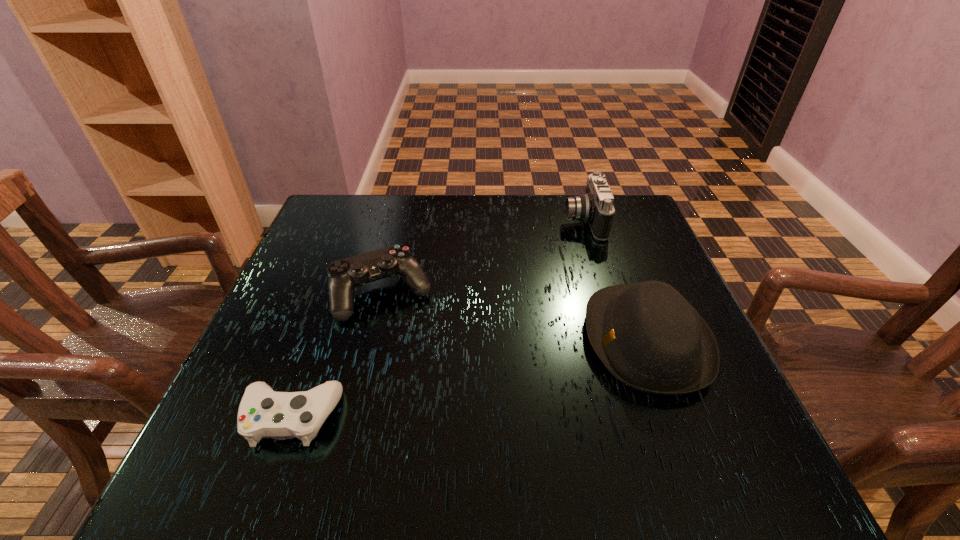
This screenshot has width=960, height=540. In the image, there is a desktop. In order to click on free space at the far edge in this screenshot , I will do `click(569, 225)`.

This screenshot has width=960, height=540. I want to click on vacant space at the near edge of the desktop, so click(x=629, y=489).

The image size is (960, 540). What are the coordinates of `vacant area at the right edge` in the screenshot? It's located at (604, 259).

Where is `free spot at the far left corner of the desktop`? Image resolution: width=960 pixels, height=540 pixels. free spot at the far left corner of the desktop is located at coordinates (307, 232).

The height and width of the screenshot is (540, 960). In the image, there is a desktop. What are the coordinates of `vacant space at the near left corner` in the screenshot? It's located at (202, 468).

Image resolution: width=960 pixels, height=540 pixels. Find the location of `free space at the far right corner of the desktop`. free space at the far right corner of the desktop is located at coordinates (641, 223).

Identify the location of vacant area at the near right corner of the desktop. point(699,483).

In order to click on free space between the camera and the farther control in this screenshot , I will do `click(483, 258)`.

Where is `empty space between the fedora and the camera`? empty space between the fedora and the camera is located at coordinates (615, 281).

Identify the location of vacant area that lies between the fedora and the taller control. Image resolution: width=960 pixels, height=540 pixels. (515, 317).